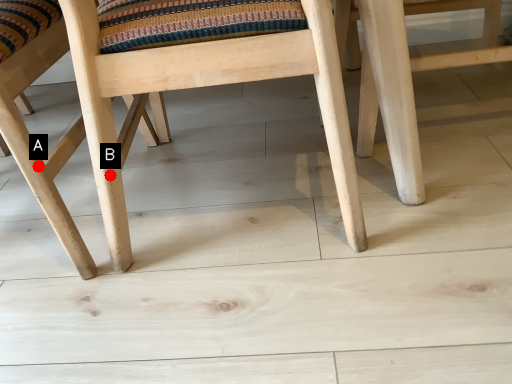
Question: Two points are circled on the image, labeled by A and B beside each circle. Which point is closer to the camera taking this photo?

Choices:
 (A) A is closer
 (B) B is closer

Answer: (A)